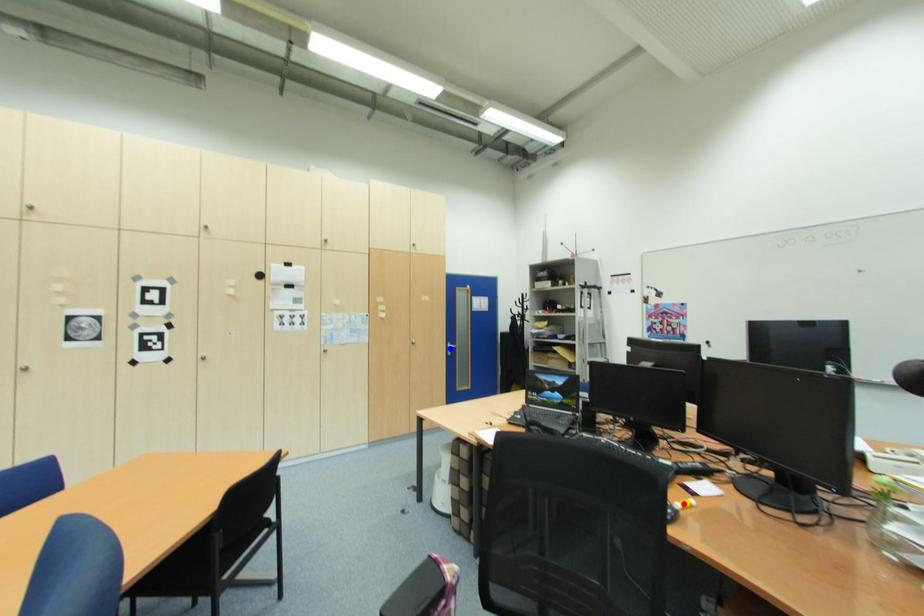
Question: Which of the two points in the image is closer to the camera?

Choices:
 (A) Blue point is closer.
 (B) Red point is closer.

Answer: (B)